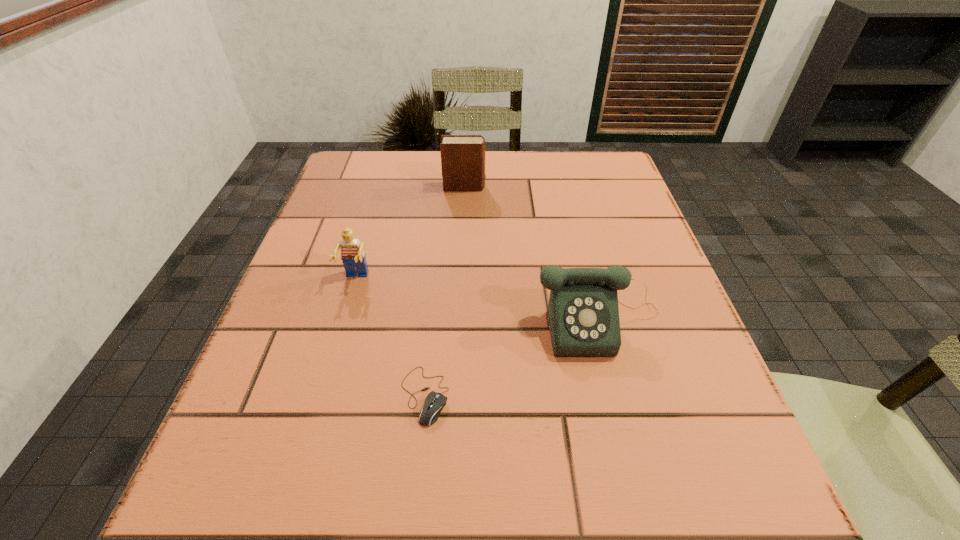
Identify the location of free space at the near right corner of the desktop. (695, 508).

Find the location of a particular element. blank region between the diary and the second nearest object is located at coordinates (532, 255).

Where is `free space between the computer mouse and the farthest object`? The width and height of the screenshot is (960, 540). free space between the computer mouse and the farthest object is located at coordinates (444, 291).

At what (x,y) coordinates should I click in order to perform the action: click on unoccupied position between the diary and the shortest object. Please return your answer as a coordinate pair (x, y). The height and width of the screenshot is (540, 960). Looking at the image, I should click on (444, 291).

The height and width of the screenshot is (540, 960). Identify the location of vacant region between the computer mouse and the rightmost object. (512, 359).

This screenshot has width=960, height=540. Find the location of `vacant area that lies between the nearest object and the rightmost object`. vacant area that lies between the nearest object and the rightmost object is located at coordinates (512, 359).

Identify the location of empty space between the computer mouse and the second farthest object. (390, 337).

What are the coordinates of `free space between the telephone and the diary` in the screenshot? It's located at (532, 255).

Locate an element on the screen. vacant region between the leftmost object and the shortest object is located at coordinates (390, 337).

Locate an element on the screen. This screenshot has width=960, height=540. blank region between the Lego and the diary is located at coordinates (410, 233).